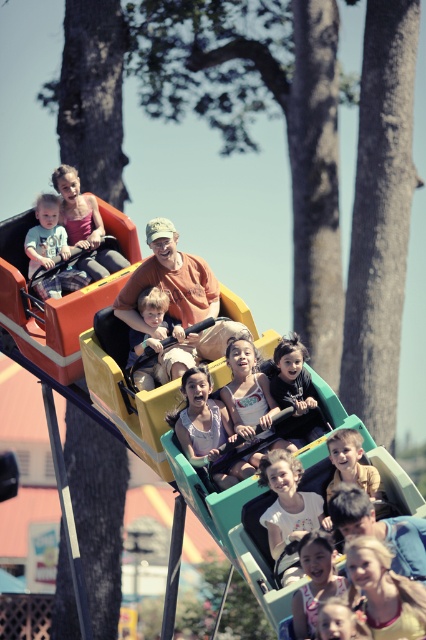
Is point (140, 369) in front of point (301, 545)?

No.

Is point (164, 323) in front of point (293, 605)?

That is False.

Identify the location of light brown fabric baby carriage at center. (155, 360).

In the scene shown: Can you confirm if light brown hair at lower center is bigger than matte yellow slide at lower center?

Actually, light brown hair at lower center might be smaller than matte yellow slide at lower center.

Who is more forward, (296, 605) or (419, 509)?

Point (296, 605)

Find the location of a particular element. light brown hair at lower center is located at coordinates (314, 580).

I want to click on matte blue shirt at center, so click(x=46, y=236).

Is matte blue shirt at center below matte yellow slide at lower center?

Incorrect, matte blue shirt at center is not positioned below matte yellow slide at lower center.

Identify the location of matte blue shirt at center. The image size is (426, 640). (46, 236).